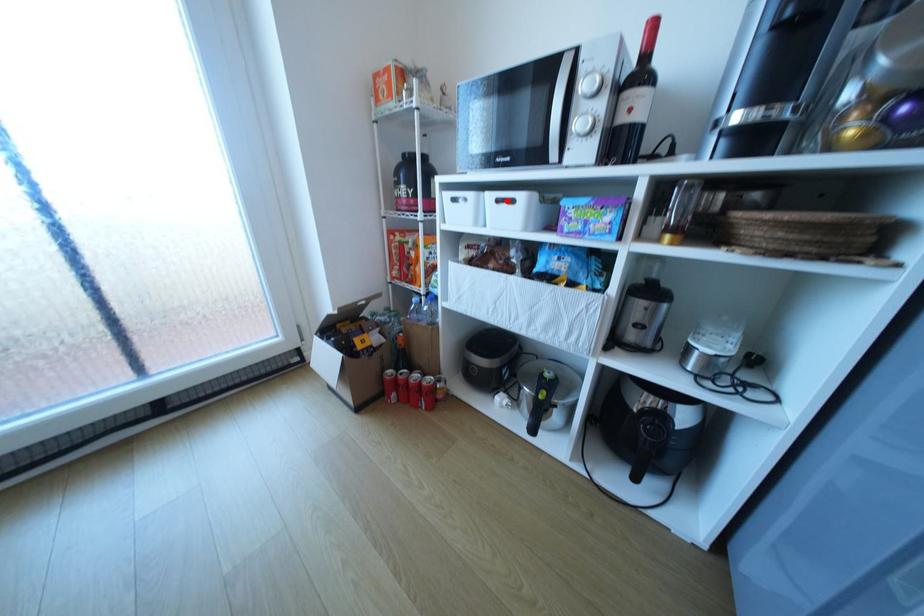
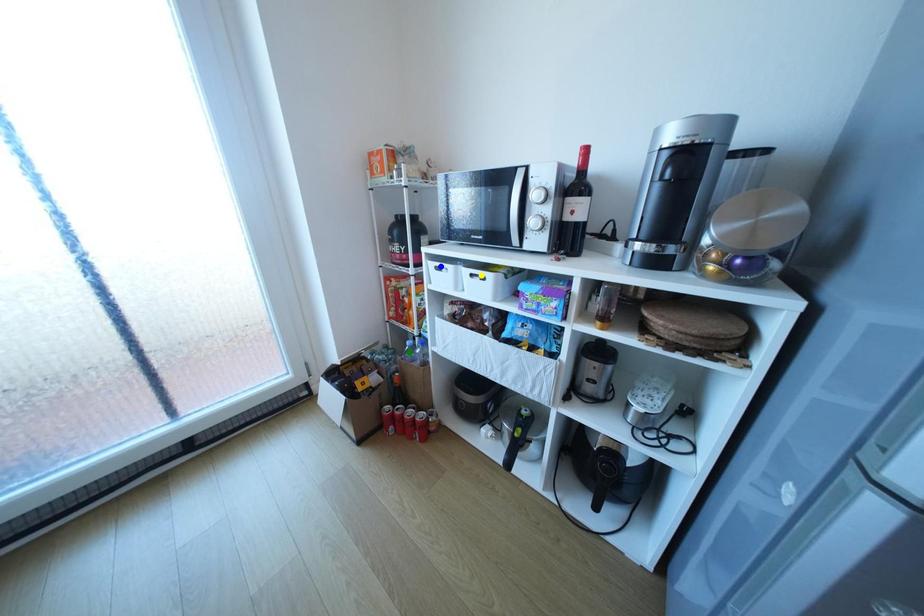
Question: I am providing you with two images of the same scene from different viewpoints. A red point is marked on the first image. You are given multiple points on the second image. Which point in image 2 is actually the same real-world point as the red point in image 1?

Choices:
 (A) blue point
 (B) green point
 (C) yellow point

Answer: (C)